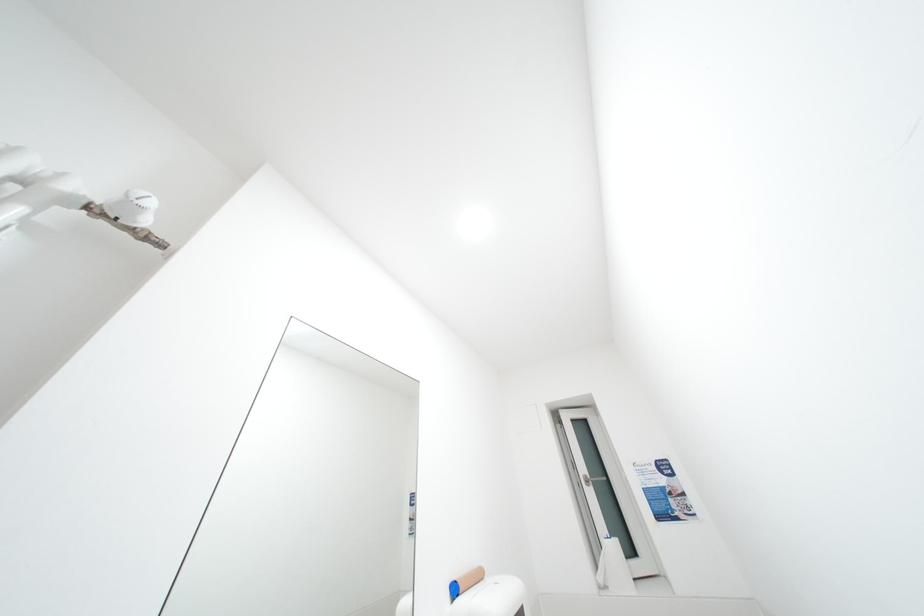
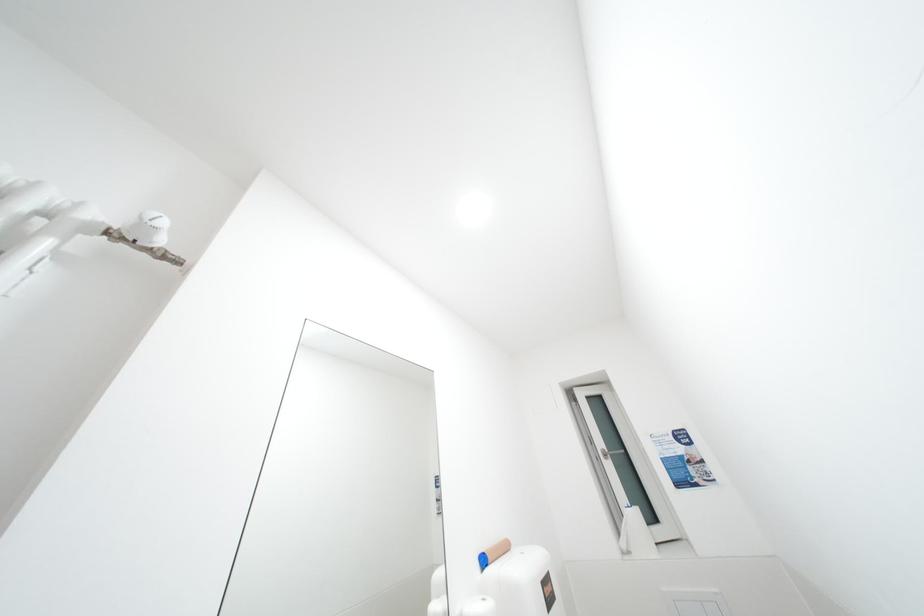
Question: The first image is from the beginning of the video and the second image is from the end. How did the camera likely rotate when shooting the video?

Choices:
 (A) Left
 (B) Right
 (C) Up
 (D) Down

Answer: (D)